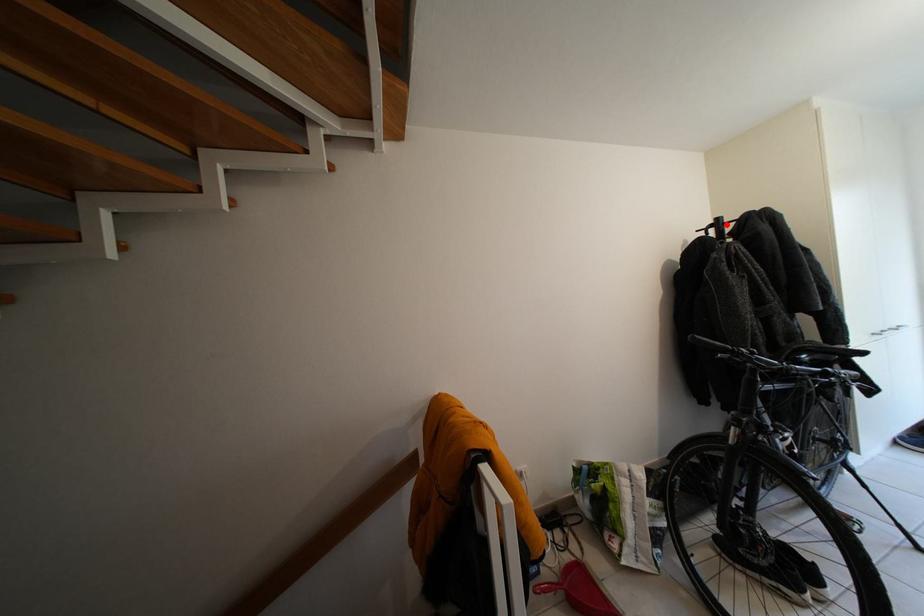
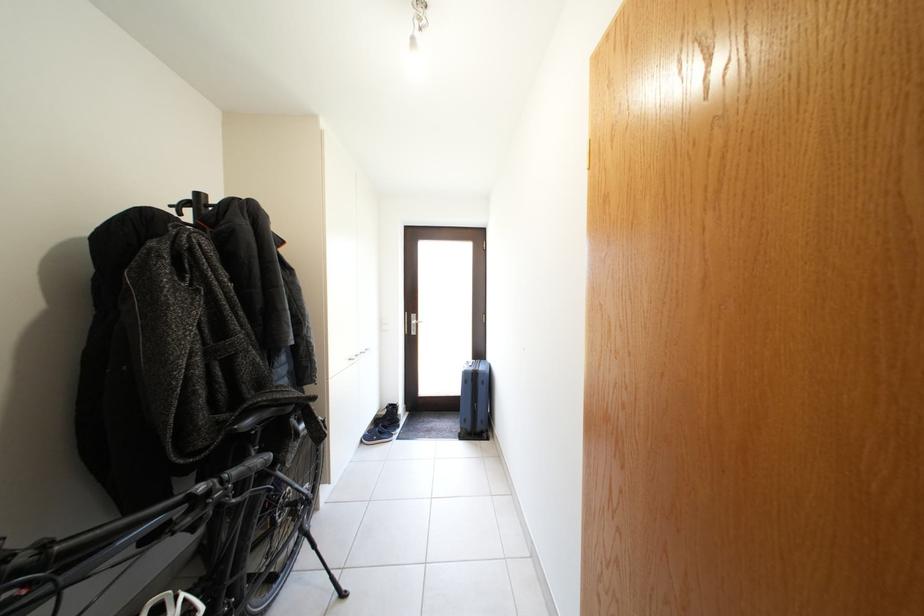
Find the pixel in the second image that matches the highlighted location in the first image.

(205, 200)